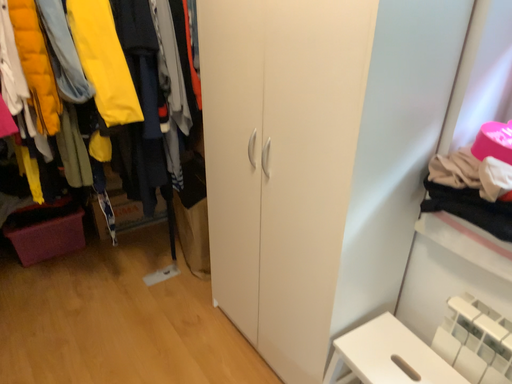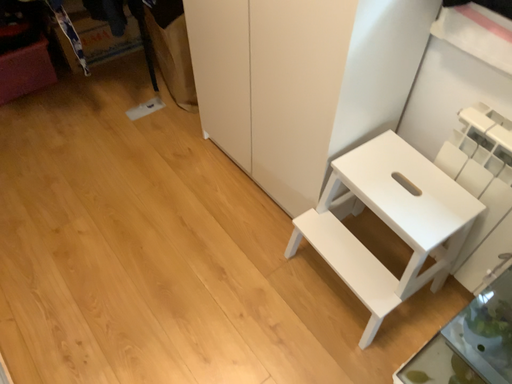
Question: Which way did the camera rotate in the video?

Choices:
 (A) rotated upward
 (B) rotated downward

Answer: (B)